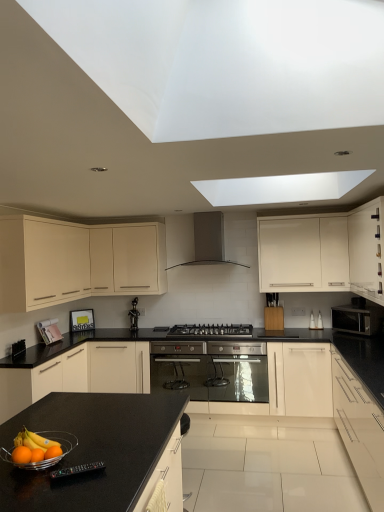
Measure the distance between stainless steel gas stove at center and camera.

The distance of stainless steel gas stove at center from camera is 4.51 meters.

What do you see at coordinates (211, 329) in the screenshot? I see `stainless steel gas stove at center` at bounding box center [211, 329].

The width and height of the screenshot is (384, 512). Describe the element at coordinates (367, 250) in the screenshot. I see `white glossy cabinet at right, which is counted as the sixth cabinetry, starting from the left` at that location.

This screenshot has height=512, width=384. What do you see at coordinates (134, 315) in the screenshot? I see `black glossy statue at center, acting as the first appliance starting from the left` at bounding box center [134, 315].

Image resolution: width=384 pixels, height=512 pixels. I want to click on black glossy statue at center, the third appliance from the front, so click(x=134, y=315).

How much space does matte cream cabinet at left, positioned as the 6th cabinetry in right-to-left order, occupy vertically?

The height of matte cream cabinet at left, positioned as the 6th cabinetry in right-to-left order, is 31.83 inches.

The image size is (384, 512). Describe the element at coordinates (208, 241) in the screenshot. I see `satin silver range hood at center` at that location.

Measure the distance between white matte cabinet at center, which is counted as the third cabinetry, starting from the right, and camera.

white matte cabinet at center, which is counted as the third cabinetry, starting from the right, and camera are 4.32 meters apart from each other.

Identify the location of matte white cabinet at upper center, the fourth cabinetry from the right. (134, 258).

Can you confirm if orange matte at lower left is bigger than satin silver range hood at center?

Incorrect, orange matte at lower left is not larger than satin silver range hood at center.

Are orange matte at lower left and satin silver range hood at center making contact?

No, orange matte at lower left is not in contact with satin silver range hood at center.

Is white matte cabinet at lower left, positioned as the second cabinetry in left-to-right order, wider than black glossy statue at center, which ranks as the third appliance in right-to-left order?

Correct, the width of white matte cabinet at lower left, positioned as the second cabinetry in left-to-right order, exceeds that of black glossy statue at center, which ranks as the third appliance in right-to-left order.

In order to click on the 1st appliance to the right when counting from the white matte cabinet at lower left, which is the fifth cabinetry in right-to-left order in this screenshot , I will do tap(134, 315).

Between white matte cabinet at lower left, positioned as the second cabinetry in left-to-right order, and black glossy statue at center, acting as the first appliance starting from the left, which one is positioned behind?

black glossy statue at center, acting as the first appliance starting from the left.

Is white matte cabinet at lower left, positioned as the second cabinetry in left-to-right order, positioned beyond the bounds of white glossy cabinet at right, positioned as the 5th cabinetry in left-to-right order?

Indeed, white matte cabinet at lower left, positioned as the second cabinetry in left-to-right order, is completely outside white glossy cabinet at right, positioned as the 5th cabinetry in left-to-right order.

Is white matte cabinet at lower left, which is the fifth cabinetry in right-to-left order, positioned far away from white glossy cabinet at right, the second cabinetry from the right?

Yes, white matte cabinet at lower left, which is the fifth cabinetry in right-to-left order, and white glossy cabinet at right, the second cabinetry from the right, are quite far apart.

Which of these two, white matte cabinet at lower left, positioned as the second cabinetry in left-to-right order, or white glossy cabinet at right, the second cabinetry from the right, stands taller?

white glossy cabinet at right, the second cabinetry from the right.

Does white matte cabinet at lower left, positioned as the second cabinetry in left-to-right order, appear on the right side of white glossy cabinet at right, positioned as the 5th cabinetry in left-to-right order?

Incorrect, white matte cabinet at lower left, positioned as the second cabinetry in left-to-right order, is not on the right side of white glossy cabinet at right, positioned as the 5th cabinetry in left-to-right order.

At what (x,y) coordinates should I click in order to perform the action: click on countertop below the stainless steel gas stove at center (from a real-world perspective). Please return your answer as a coordinate pair (x, y). Looking at the image, I should click on (92, 450).

Does point (222, 326) appear closer or farther from the camera than point (79, 461)?

Point (222, 326) is positioned farther from the camera compared to point (79, 461).

From the image's perspective, would you say stainless steel gas stove at center is shown under black granite countertop at lower left?

No, from the image's perspective, stainless steel gas stove at center is not below black granite countertop at lower left.

Does matte black microwave at right have a lesser width compared to black glossy statue at center, positioned as the third appliance in bottom-to-top order?

In fact, matte black microwave at right might be wider than black glossy statue at center, positioned as the third appliance in bottom-to-top order.

Is black glossy statue at center, positioned as the third appliance in bottom-to-top order, inside matte black microwave at right?

That's incorrect, black glossy statue at center, positioned as the third appliance in bottom-to-top order, is not inside matte black microwave at right.

Which is less distant, (371, 322) or (132, 310)?

The point (371, 322) is in front.

Is matte black microwave at right positioned in front of black glossy statue at center, the third appliance from the front?

Yes, matte black microwave at right is in front of black glossy statue at center, the third appliance from the front.

Is satin silver range hood at center not inside stainless steel oven at center, the 2th appliance viewed from the front?

Indeed, satin silver range hood at center is completely outside stainless steel oven at center, the 2th appliance viewed from the front.

What's the angular difference between satin silver range hood at center and stainless steel oven at center, the third appliance when ordered from left to right,'s facing directions?

satin silver range hood at center and stainless steel oven at center, the third appliance when ordered from left to right, are facing 0.303 degrees away from each other.

Between satin silver range hood at center and stainless steel oven at center, the third appliance when ordered from left to right, which one is positioned in front?

stainless steel oven at center, the third appliance when ordered from left to right.

Considering the relative positions of matte black microwave at right and black plastic remote control at lower left, the first appliance from the front, in the image provided, is matte black microwave at right in front of black plastic remote control at lower left, the first appliance from the front,?

No, it is behind black plastic remote control at lower left, the first appliance from the front.

In terms of height, does matte black microwave at right look taller or shorter compared to black plastic remote control at lower left, which appears as the second appliance when viewed from the left?

In the image, matte black microwave at right appears to be taller than black plastic remote control at lower left, which appears as the second appliance when viewed from the left.

In the scene shown: Between matte black microwave at right and black plastic remote control at lower left, acting as the second appliance starting from the right, which one has larger size?

Bigger between the two is matte black microwave at right.

Where is `home appliance above the orange matte at lower left (from the image's perspective)`? home appliance above the orange matte at lower left (from the image's perspective) is located at coordinates (208, 241).

From a real-world perspective, which appliance is the 3rd one above the white matte cabinet at lower left, which is the fifth cabinetry in right-to-left order? Please provide its 2D coordinates.

[(134, 315)]

From the image, which object appears to be nearer to black plastic remote control at lower left, which appears as the second appliance when viewed from the left, stainless steel oven at center, acting as the 2th appliance starting from the back, or white matte cabinet at center, which is counted as the third cabinetry, starting from the right?

white matte cabinet at center, which is counted as the third cabinetry, starting from the right, is positioned closer to the anchor black plastic remote control at lower left, which appears as the second appliance when viewed from the left.

Looking at the image, which one is located further to matte cream cabinet at left, positioned as the first cabinetry in left-to-right order, matte black microwave at right or black plastic remote control at lower left, the 2th appliance viewed from the top?

black plastic remote control at lower left, the 2th appliance viewed from the top, is positioned further to the anchor matte cream cabinet at left, positioned as the first cabinetry in left-to-right order.

From the image, which object appears to be farther from stainless steel oven at center, the first appliance ordered from the bottom, matte black microwave at right or matte cream cabinet at left, positioned as the 6th cabinetry in right-to-left order?

matte black microwave at right is further to stainless steel oven at center, the first appliance ordered from the bottom.

Estimate the real-world distances between objects in this image. Which object is closer to black plastic remote control at lower left, arranged as the third appliance when viewed from the back, white glossy cabinet at right, the second cabinetry from the right, or black glossy statue at center, the 1th appliance when ordered from back to front?

white glossy cabinet at right, the second cabinetry from the right, is closer to black plastic remote control at lower left, arranged as the third appliance when viewed from the back.

Estimate the real-world distances between objects in this image. Which object is closer to stainless steel oven at center, the 2th appliance viewed from the front, white glossy cabinet at right, arranged as the 1th cabinetry when viewed from the right, or satin silver range hood at center?

Based on the image, satin silver range hood at center appears to be nearer to stainless steel oven at center, the 2th appliance viewed from the front.

From the image, which object appears to be farther from black plastic remote control at lower left, the first appliance from the front, white glossy cabinet at right, which is counted as the sixth cabinetry, starting from the left, or orange matte at lower left?

white glossy cabinet at right, which is counted as the sixth cabinetry, starting from the left, is positioned further to the anchor black plastic remote control at lower left, the first appliance from the front.

From the image, which object appears to be farther from stainless steel gas stove at center, matte white cabinet at upper center, the fourth cabinetry from the right, or stainless steel oven at center, the 2th appliance viewed from the front?

matte white cabinet at upper center, the fourth cabinetry from the right, is further to stainless steel gas stove at center.

Estimate the real-world distances between objects in this image. Which object is further from matte black microwave at right, black plastic remote control at lower left, the second appliance positioned from the bottom, or black granite countertop at lower left?

black plastic remote control at lower left, the second appliance positioned from the bottom, is positioned further to the anchor matte black microwave at right.

Where is `countertop between white matte cabinet at lower left, which is the fifth cabinetry in right-to-left order, and matte black microwave at right from left to right`? Image resolution: width=384 pixels, height=512 pixels. countertop between white matte cabinet at lower left, which is the fifth cabinetry in right-to-left order, and matte black microwave at right from left to right is located at coordinates (92, 450).

The image size is (384, 512). I want to click on home appliance between orange matte at lower left and matte white cabinet at upper center, positioned as the third cabinetry in left-to-right order, along the z-axis, so click(208, 241).

Where is `appliance positioned between black granite countertop at lower left and white matte cabinet at lower left, which is the fifth cabinetry in right-to-left order, from near to far`? This screenshot has width=384, height=512. appliance positioned between black granite countertop at lower left and white matte cabinet at lower left, which is the fifth cabinetry in right-to-left order, from near to far is located at coordinates (77, 470).

Where is `appliance between black plastic remote control at lower left, the first appliance from the front, and black glossy statue at center, positioned as the third appliance in bottom-to-top order, from front to back`? Image resolution: width=384 pixels, height=512 pixels. appliance between black plastic remote control at lower left, the first appliance from the front, and black glossy statue at center, positioned as the third appliance in bottom-to-top order, from front to back is located at coordinates (180, 367).